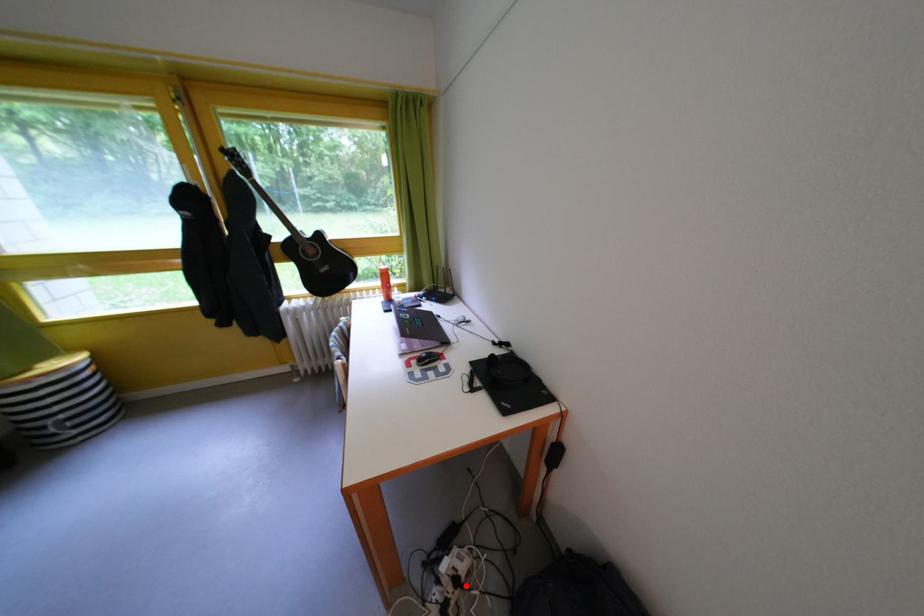
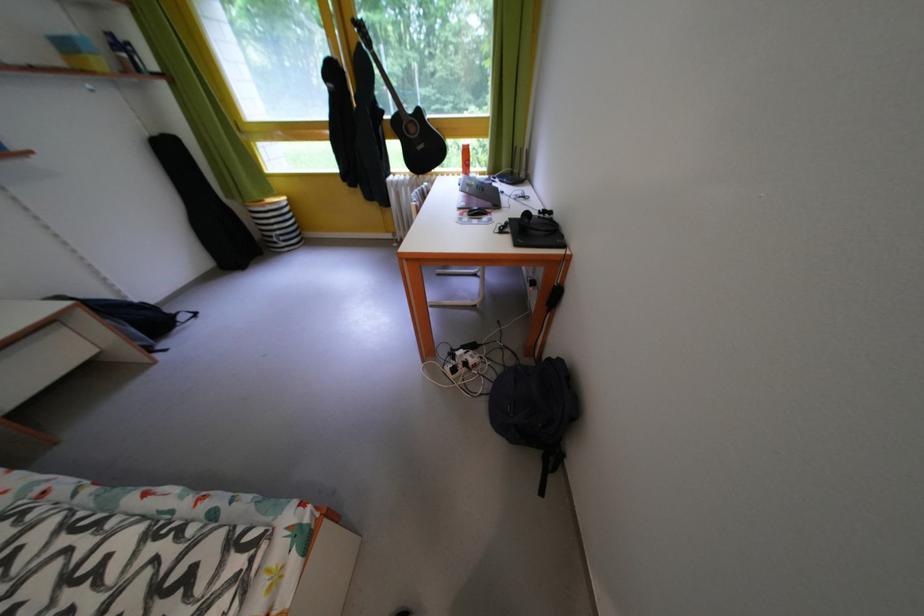
The point at the highlighted location is marked in the first image. Where is the corresponding point in the second image?

(476, 370)